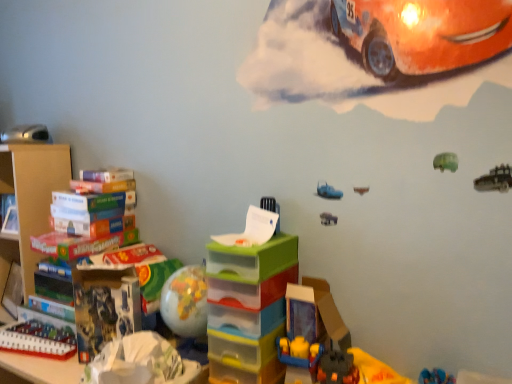
Question: In which direction should I rotate to look at translucent plastic toy at lower center, which is the fourth toy in left-to-right order?

Choices:
 (A) left
 (B) right

Answer: (B)

Question: Considering the relative sizes of cardboard at left and matte black toy car at left, which is the fourth toy from bottom to top, in the image provided, is cardboard at left smaller than matte black toy car at left, which is the fourth toy from bottom to top,?

Choices:
 (A) no
 (B) yes

Answer: (A)

Question: Can you confirm if cardboard at left is bigger than matte black toy car at left, which is the 1th toy from top to bottom?

Choices:
 (A) yes
 (B) no

Answer: (A)

Question: Is the position of cardboard at left less distant than that of matte black toy car at left, which is the 1th toy from top to bottom?

Choices:
 (A) no
 (B) yes

Answer: (B)

Question: Is matte black toy car at left, which is the 1th toy from top to bottom, a part of cardboard at left?

Choices:
 (A) no
 (B) yes

Answer: (A)

Question: Considering the relative sizes of cardboard at left and matte black toy car at left, which is the 1th toy from top to bottom, in the image provided, is cardboard at left taller than matte black toy car at left, which is the 1th toy from top to bottom,?

Choices:
 (A) no
 (B) yes

Answer: (B)

Question: Is the depth of cardboard at left greater than that of matte black toy car at left, the 1th toy positioned from the left?

Choices:
 (A) yes
 (B) no

Answer: (B)

Question: Considering the relative positions of matte black toy car at left, which appears as the fourth toy when viewed from the right, and translucent plastic toy at lower center, which appears as the first toy when viewed from the right, in the image provided, is matte black toy car at left, which appears as the fourth toy when viewed from the right, to the right of translucent plastic toy at lower center, which appears as the first toy when viewed from the right, from the viewer's perspective?

Choices:
 (A) yes
 (B) no

Answer: (B)

Question: Is matte black toy car at left, which is the fourth toy from bottom to top, smaller than translucent plastic toy at lower center, which is the fourth toy in left-to-right order?

Choices:
 (A) no
 (B) yes

Answer: (B)

Question: From the image's perspective, is matte black toy car at left, which is the 1th toy from top to bottom, located beneath translucent plastic toy at lower center, the 2th toy from the top?

Choices:
 (A) no
 (B) yes

Answer: (A)

Question: Is matte black toy car at left, which appears as the fourth toy when viewed from the right, far from translucent plastic toy at lower center, the 2th toy from the top?

Choices:
 (A) yes
 (B) no

Answer: (A)

Question: Is matte black toy car at left, which is the fourth toy from bottom to top, to the left of translucent plastic toy at lower center, placed as the third toy when sorted from bottom to top, from the viewer's perspective?

Choices:
 (A) no
 (B) yes

Answer: (B)

Question: Considering the relative sizes of matte black toy car at left, which appears as the fourth toy when viewed from the right, and translucent plastic toy at lower center, which appears as the first toy when viewed from the right, in the image provided, is matte black toy car at left, which appears as the fourth toy when viewed from the right, wider than translucent plastic toy at lower center, which appears as the first toy when viewed from the right,?

Choices:
 (A) no
 (B) yes

Answer: (A)

Question: Is translucent plastic toy at lower center, the 2th toy from the top, located outside translucent plastic building blocks at lower left, placed as the 3th toy when sorted from right to left?

Choices:
 (A) no
 (B) yes

Answer: (B)